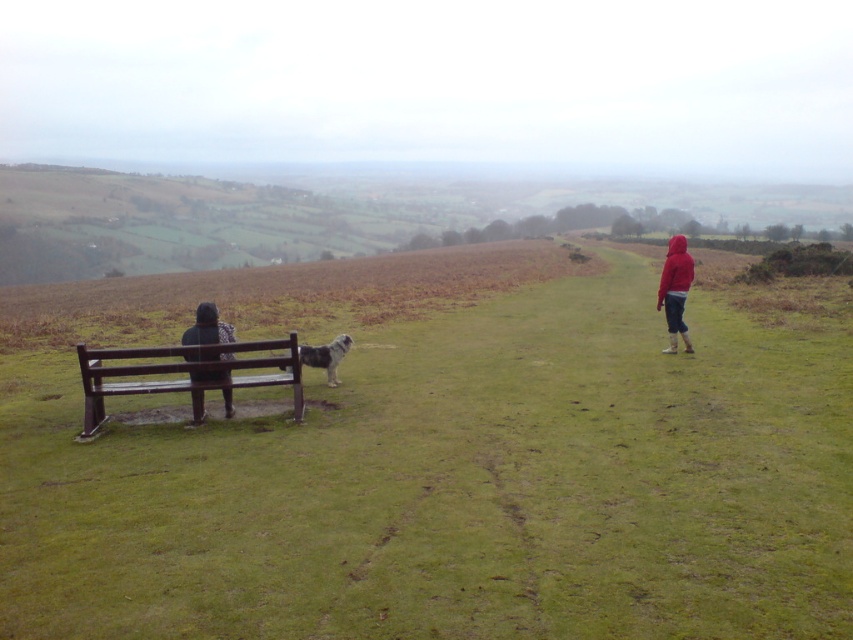
Question: Which object is positioned farthest from the dark textured jacket at left?

Choices:
 (A) red fleece jacket at right
 (B) green grassy field at center

Answer: (A)

Question: Can you confirm if brown wooden bench at left is positioned above red fleece jacket at right?

Choices:
 (A) yes
 (B) no

Answer: (B)

Question: Among these points, which one is farthest from the camera?

Choices:
 (A) (260, 346)
 (B) (202, 353)
 (C) (659, 300)
 (D) (213, 602)

Answer: (C)

Question: Is the position of green grassy field at center more distant than that of dark textured jacket at left?

Choices:
 (A) no
 (B) yes

Answer: (A)

Question: Which of these objects is positioned farthest from the dark textured jacket at left?

Choices:
 (A) brown wooden bench at left
 (B) red fleece jacket at right
 (C) green grassy field at center
 (D) white fluffy dog at center

Answer: (B)

Question: Where is dark textured jacket at left located in relation to white fluffy dog at center in the image?

Choices:
 (A) left
 (B) right

Answer: (A)